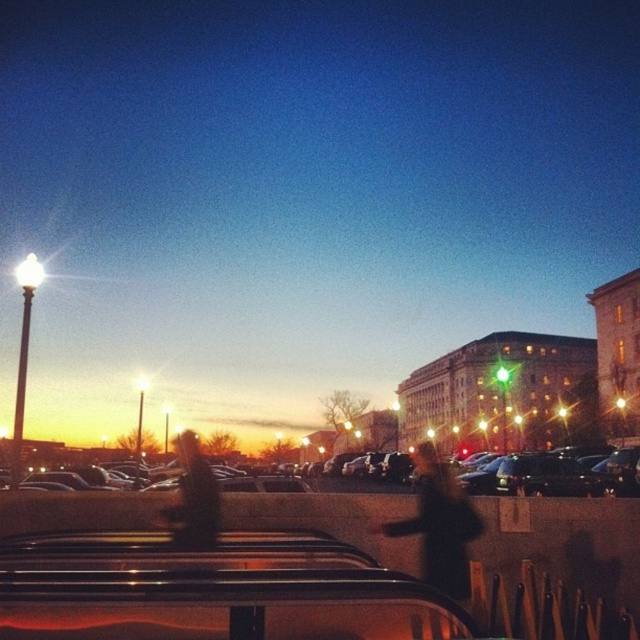
From the picture: You are a pedestrian standing at the edge of the parking lot. You see the metallic gray cars at center and the dark brown leather jacket at center. Which object is closer to you?

The dark brown leather jacket at center is closer to you because it is only 15.40 meters away from the metallic gray cars at center, but without knowing your exact position, we can infer based on typical parking lot layouts that jackets are usually near people, so the jacket is likely closer.

You are a pedestrian trying to cross the parking lot at night. You see the metallic gray cars at center and the dark brown leather jacket at center. Which object is closer to you?

The metallic gray cars at center are closer to you because they are positioned over the dark brown leather jacket at center, indicating they are in front of it.

You are a delivery person who needs to load a large package into the back of a truck. You see the metallic gray cars at center and the black matte coat at center in the parking lot. Which object is more suitable for loading the package?

The metallic gray cars at center is much taller as black matte coat at center, so the metallic gray cars at center is more suitable for loading the large package because it has a taller height, providing enough space.